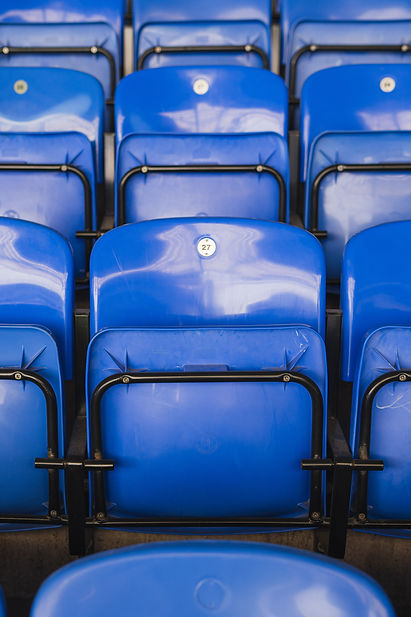
At what (x,y) coordinates should I click in order to perform the action: click on blue chair. Please return your answer as a coordinate pair (x, y). The width and height of the screenshot is (411, 617). Looking at the image, I should click on (227, 580), (224, 297), (73, 15), (60, 92), (26, 257), (220, 110), (241, 12), (350, 12), (367, 83), (380, 258).